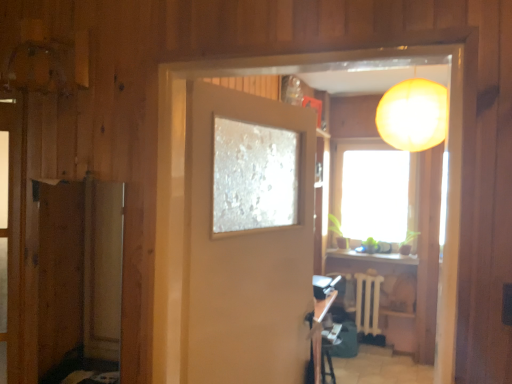
Question: Are matte orange lampshade at upper right and transparent glass window at center far apart?

Choices:
 (A) yes
 (B) no

Answer: (A)

Question: From the image's perspective, is matte orange lampshade at upper right on transparent glass window at center?

Choices:
 (A) no
 (B) yes

Answer: (B)

Question: Is matte orange lampshade at upper right facing away from transparent glass window at center?

Choices:
 (A) no
 (B) yes

Answer: (B)

Question: From the image's perspective, is matte orange lampshade at upper right located beneath transparent glass window at center?

Choices:
 (A) no
 (B) yes

Answer: (A)

Question: Would you say transparent glass window at center is part of matte orange lampshade at upper right's contents?

Choices:
 (A) no
 (B) yes

Answer: (A)

Question: Considering the relative positions of matte orange lampshade at upper right and transparent glass window at center in the image provided, is matte orange lampshade at upper right to the left of transparent glass window at center from the viewer's perspective?

Choices:
 (A) no
 (B) yes

Answer: (B)

Question: Does transparent glass window at center lie in front of wooden table at lower center?

Choices:
 (A) yes
 (B) no

Answer: (B)

Question: Would you say transparent glass window at center contains wooden table at lower center?

Choices:
 (A) no
 (B) yes

Answer: (A)

Question: Considering the relative sizes of transparent glass window at center and wooden table at lower center in the image provided, is transparent glass window at center shorter than wooden table at lower center?

Choices:
 (A) yes
 (B) no

Answer: (B)

Question: Can you confirm if transparent glass window at center is positioned to the left of wooden table at lower center?

Choices:
 (A) yes
 (B) no

Answer: (B)

Question: Would you say transparent glass window at center is a long distance from wooden table at lower center?

Choices:
 (A) yes
 (B) no

Answer: (A)

Question: Is transparent glass window at center bigger than wooden table at lower center?

Choices:
 (A) no
 (B) yes

Answer: (B)

Question: Is wooden screen door at left outside of wooden table at lower center?

Choices:
 (A) no
 (B) yes

Answer: (B)